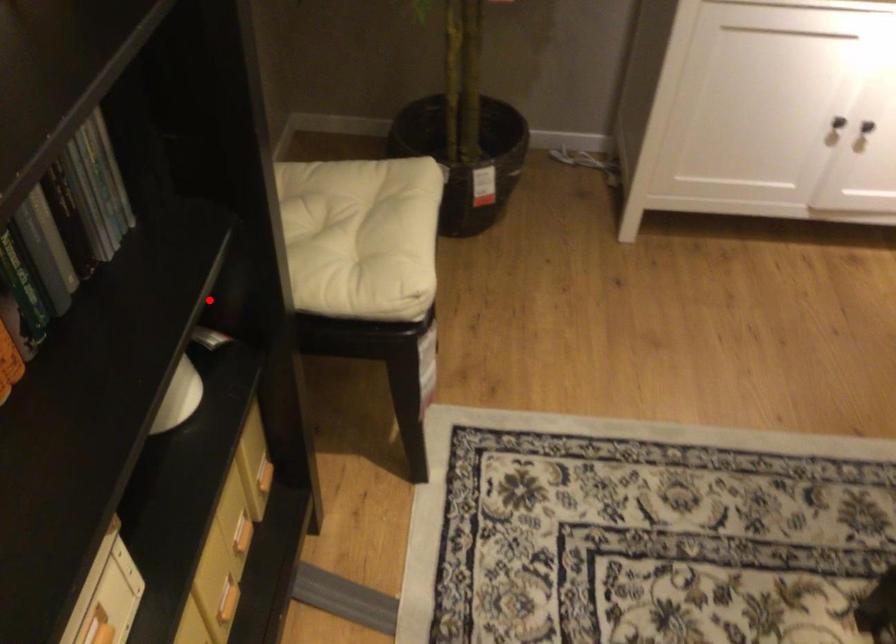
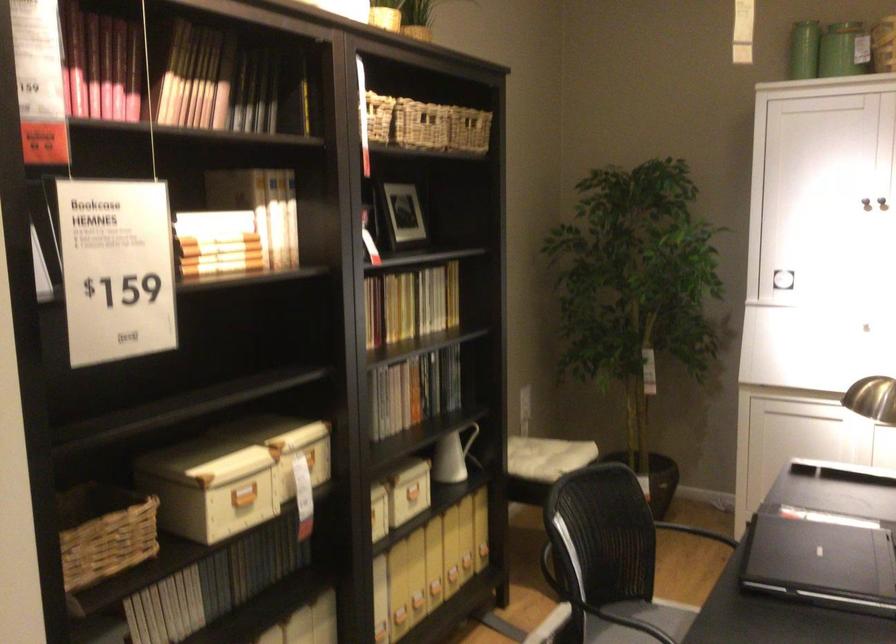
The point at the highlighted location is marked in the first image. Where is the corresponding point in the second image?

(474, 444)